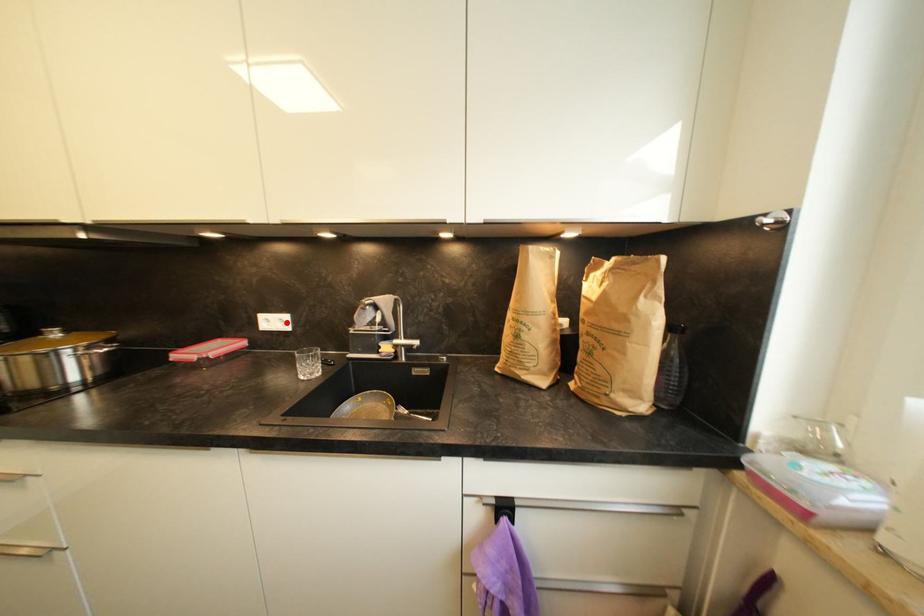
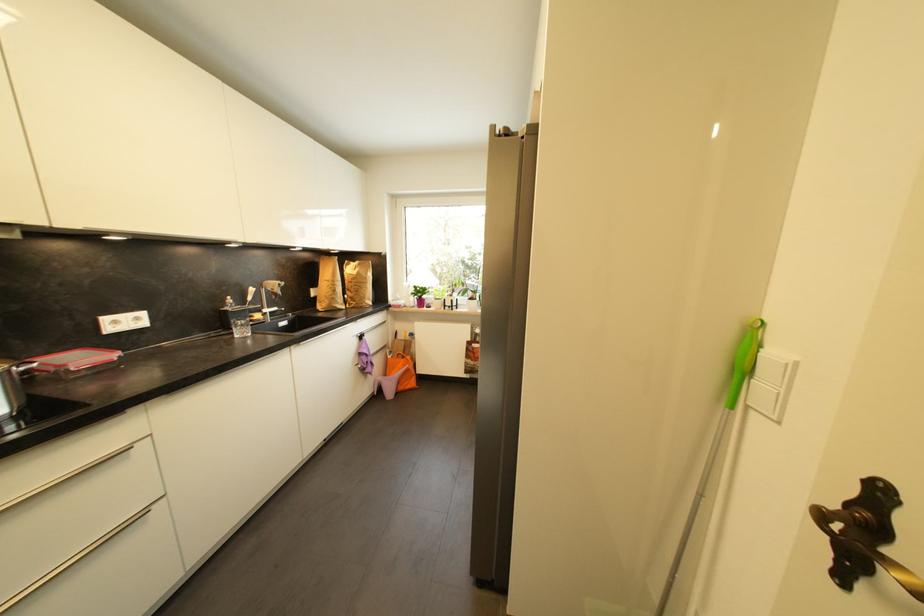
In the second image, find the point that corresponds to the highlighted location in the first image.

(142, 321)